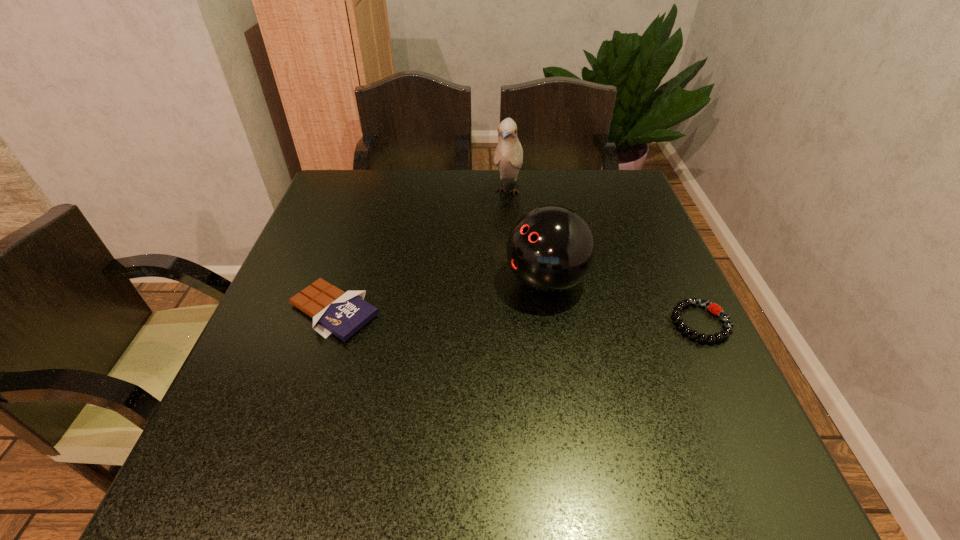
At what (x,y) coordinates should I click in order to perform the action: click on vacant space located 0.170m on the surface of the bowling ball near the finger holes. Please return your answer as a coordinate pair (x, y). Image resolution: width=960 pixels, height=540 pixels. Looking at the image, I should click on (444, 327).

The width and height of the screenshot is (960, 540). Find the location of `free point located 0.140m on the surface of the bowling ball near the finger holes`. free point located 0.140m on the surface of the bowling ball near the finger holes is located at coordinates (457, 321).

What are the coordinates of `vacant space situated at the beak of the tallest object` in the screenshot? It's located at (502, 221).

The image size is (960, 540). What are the coordinates of `blank space located at the beak of the tallest object` in the screenshot? It's located at (500, 228).

Identify the location of free spot located 0.070m at the beak of the tallest object. This screenshot has height=540, width=960. (500, 226).

Find the location of `object present at the far edge`. object present at the far edge is located at coordinates coord(508,156).

Locate an element on the screen. This screenshot has width=960, height=540. object that is at the left edge is located at coordinates (333, 311).

You are a GUI agent. You are given a task and a screenshot of the screen. Output one action in this format:
    pyautogui.click(x=<x>, y=<y>)
    Task: Click on the object that is at the right edge
    
    Given the screenshot: What is the action you would take?
    pyautogui.click(x=712, y=307)

Locate an element on the screen. Image resolution: width=960 pixels, height=540 pixels. free space at the far edge of the desktop is located at coordinates (443, 180).

The image size is (960, 540). Identify the location of free location at the left edge of the desktop. (367, 223).